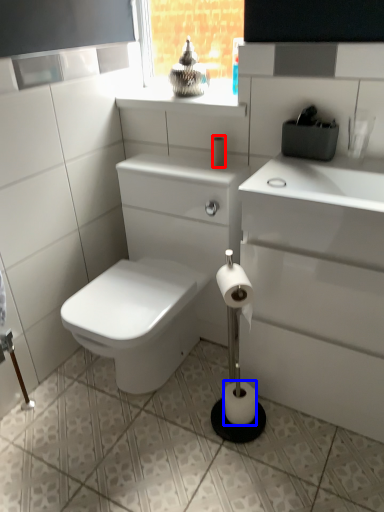
Question: Which point is closer to the camera, toilet paper (highlighted by a red box) or toilet paper (highlighted by a blue box)?

Choices:
 (A) toilet paper
 (B) toilet paper

Answer: (B)